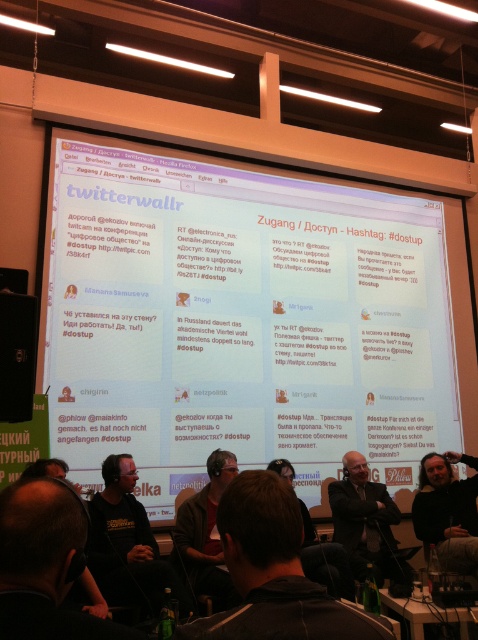
Looking at this image, you are organizing a photo shoot and need to place a mannequin wearing a dark brown leather jacket at lower left next to a mannequin in a dark gray suit at center. Given their sizes, which mannequin should be placed closer to the camera to ensure both appear proportionate in the final image?

The dark brown leather jacket at lower left has a lesser width compared to the dark gray suit at center. To ensure proportionality, place the dark brown leather jacket at lower left closer to the camera so it appears larger, balancing its size with the wider dark gray suit at center.

You are an event organizer who needs to adjust the seating for better visibility. The brown leather jacket at center and the black matte speaker at left are in the way of the new seating arrangement. Which object should you move first to clear the path?

The brown leather jacket at center should be moved first because it is located below the black matte speaker at left, meaning it is closer to the ground and easier to relocate without disturbing the speaker.

You are organizing a photo shoot and need to place a 1.2 meter wide backdrop behind both the brown leather jacket at center and the black matte speaker at left. Can the backdrop accommodate both objects without overlapping them?

The brown leather jacket at center is wider than the black matte speaker at left. Since the backdrop is 1.2 meters wide, it can accommodate both objects as long as their combined width doesn